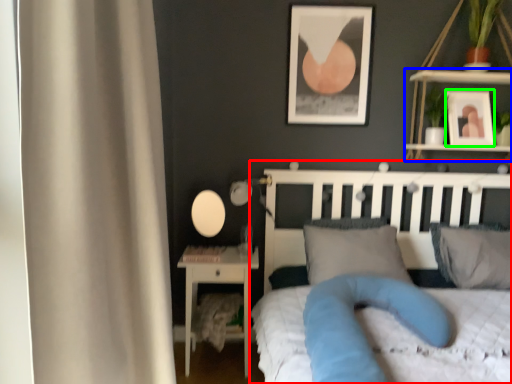
Question: Considering the real-world distances, which object is closest to bed (highlighted by a red box)? shelf (highlighted by a blue box) or picture frame (highlighted by a green box).

Choices:
 (A) shelf
 (B) picture frame

Answer: (B)